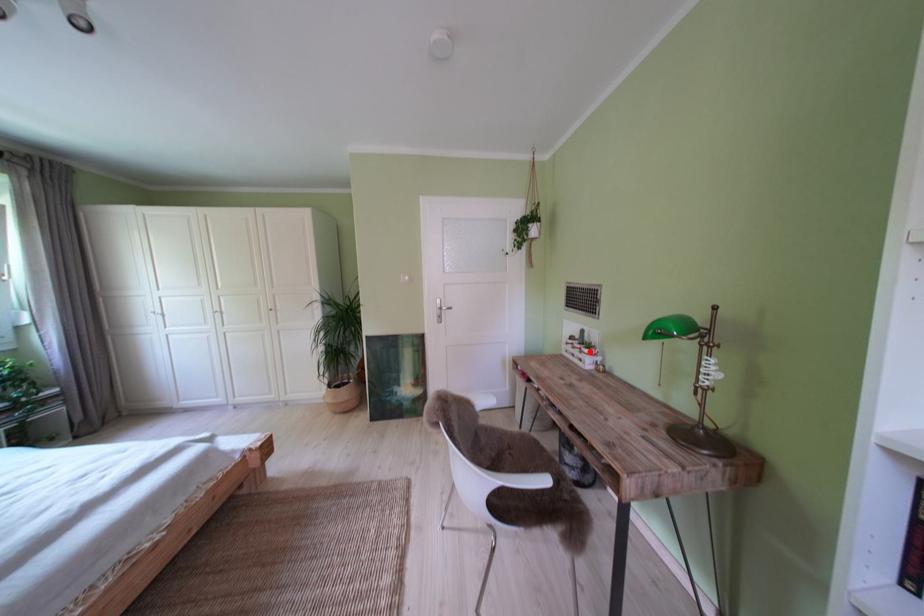
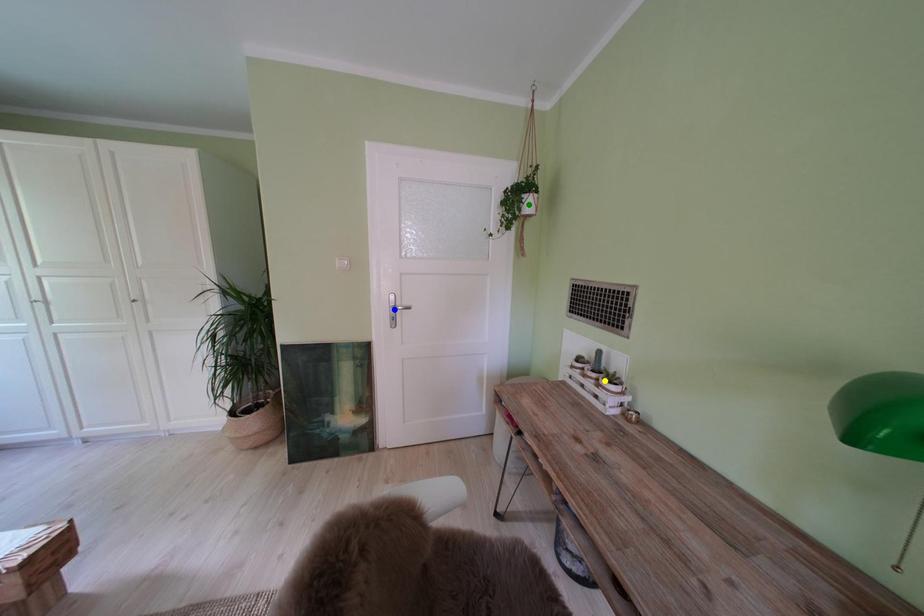
Question: I am providing you with two images of the same scene from different viewpoints. A red point is marked on the first image. You are given multiple points on the second image. Which point in image 2 represents the same 3d spot as the red point in image 1?

Choices:
 (A) green point
 (B) blue point
 (C) yellow point

Answer: (C)